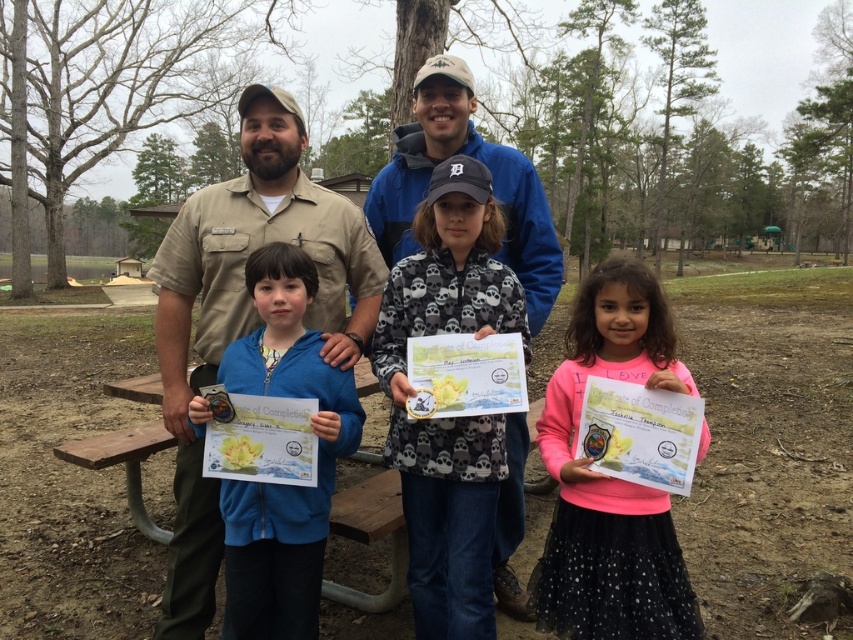
You are standing in the park and see two points marked in the image. Which point is closer to you, point (421, 627) or point (258, 541)?

Point (258, 541) is closer to you because it is less further than point (421, 627).

What is located at the coordinate point (245, 240) in the image?

The matte blue jacket at center is located at point (245, 240).